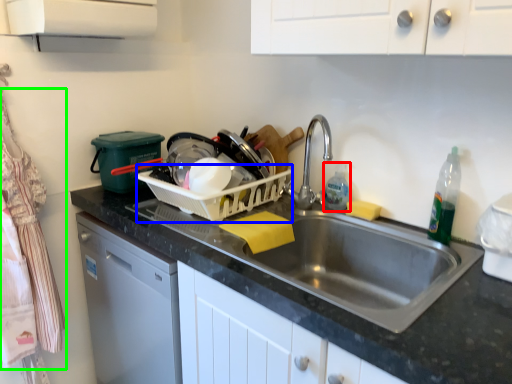
Question: Which object is positioned farthest from cleaning product (highlighted by a red box)? Select from basket (highlighted by a blue box) and laundry (highlighted by a green box).

Choices:
 (A) basket
 (B) laundry

Answer: (B)